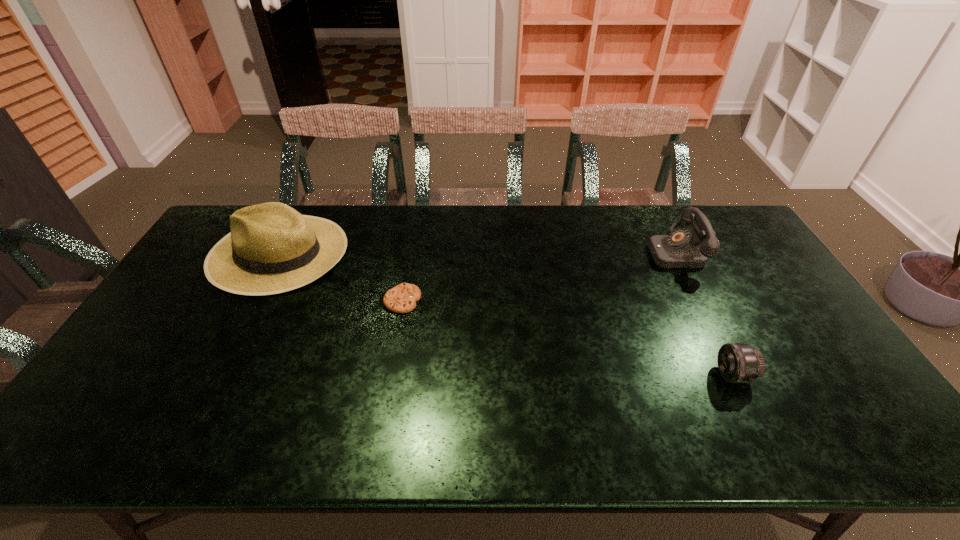
The width and height of the screenshot is (960, 540). In order to click on sunhat in this screenshot , I will do `click(272, 248)`.

Where is `telephone`? The width and height of the screenshot is (960, 540). telephone is located at coordinates (683, 248).

Locate an element on the screen. the third tallest object is located at coordinates (738, 363).

Where is `the nearest object`? the nearest object is located at coordinates (738, 363).

Locate an element on the screen. This screenshot has width=960, height=540. the shortest object is located at coordinates (402, 298).

This screenshot has height=540, width=960. I want to click on the second object from left to right, so click(402, 298).

Locate an element on the screen. The width and height of the screenshot is (960, 540). blank space located 0.140m on the right of the leftmost object is located at coordinates (388, 252).

Find the location of a particular element. The image size is (960, 540). vacant area situated on the dial of the telephone is located at coordinates [613, 252].

Locate an element on the screen. The width and height of the screenshot is (960, 540). free spot located on the dial of the telephone is located at coordinates (531, 252).

You are a GUI agent. You are given a task and a screenshot of the screen. Output one action in this format:
    pyautogui.click(x=<x>, y=<y>)
    Task: Click on the vacant space located 0.070m on the dial of the telephone
    The width and height of the screenshot is (960, 540).
    Given the screenshot: What is the action you would take?
    pyautogui.click(x=629, y=252)